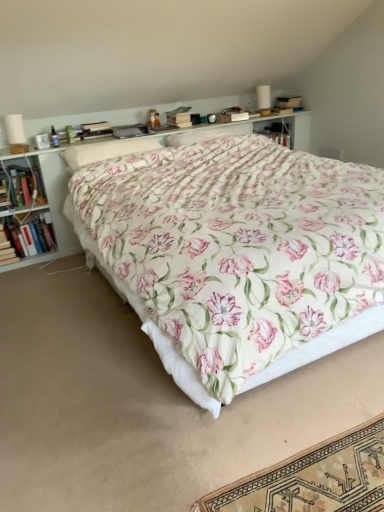
Question: Considering the relative sizes of floral cotton bed at center and floral fabric pillow at center, positioned as the second pillow in right-to-left order, in the image provided, is floral cotton bed at center smaller than floral fabric pillow at center, positioned as the second pillow in right-to-left order,?

Choices:
 (A) yes
 (B) no

Answer: (B)

Question: Does floral cotton bed at center have a lesser width compared to floral fabric pillow at center, positioned as the second pillow in right-to-left order?

Choices:
 (A) no
 (B) yes

Answer: (A)

Question: Can you confirm if floral cotton bed at center is positioned to the right of floral fabric pillow at center, positioned as the second pillow in right-to-left order?

Choices:
 (A) no
 (B) yes

Answer: (B)

Question: From a real-world perspective, is floral cotton bed at center located higher than floral fabric pillow at center, which ranks as the 1th pillow in left-to-right order?

Choices:
 (A) yes
 (B) no

Answer: (B)

Question: Is floral cotton bed at center at the left side of floral fabric pillow at center, which ranks as the 1th pillow in left-to-right order?

Choices:
 (A) yes
 (B) no

Answer: (B)

Question: Looking at the image, does floral fabric pillow at center, positioned as the second pillow in right-to-left order, seem bigger or smaller compared to floral cotton bed at center?

Choices:
 (A) big
 (B) small

Answer: (B)

Question: From a real-world perspective, is floral fabric pillow at center, positioned as the second pillow in right-to-left order, physically located above or below floral cotton bed at center?

Choices:
 (A) above
 (B) below

Answer: (A)

Question: Does point (77, 159) appear closer or farther from the camera than point (380, 257)?

Choices:
 (A) farther
 (B) closer

Answer: (A)

Question: From the image's perspective, is floral fabric pillow at center, positioned as the second pillow in right-to-left order, above or below floral cotton bed at center?

Choices:
 (A) above
 (B) below

Answer: (A)

Question: Is floral fabric pillow at center, which ranks as the 1th pillow in left-to-right order, situated inside hardcover book at left, arranged as the second book when viewed from the top, or outside?

Choices:
 (A) outside
 (B) inside

Answer: (A)

Question: From the image's perspective, is floral fabric pillow at center, which ranks as the 1th pillow in left-to-right order, above or below hardcover book at left, arranged as the 2th book when ordered from the bottom?

Choices:
 (A) below
 (B) above

Answer: (B)

Question: Looking at their shapes, would you say floral fabric pillow at center, which ranks as the 1th pillow in left-to-right order, is wider or thinner than hardcover book at left, arranged as the 2th book when ordered from the bottom?

Choices:
 (A) thin
 (B) wide

Answer: (B)

Question: Does point (137, 140) appear closer or farther from the camera than point (23, 238)?

Choices:
 (A) farther
 (B) closer

Answer: (B)

Question: Looking at their shapes, would you say hardcover book at left, arranged as the 2th book when ordered from the bottom, is wider or thinner than floral fabric pillow at center, which ranks as the 1th pillow in left-to-right order?

Choices:
 (A) wide
 (B) thin

Answer: (B)

Question: From the image's perspective, is hardcover book at left, arranged as the 2th book when ordered from the bottom, positioned above or below floral fabric pillow at center, positioned as the second pillow in right-to-left order?

Choices:
 (A) below
 (B) above

Answer: (A)